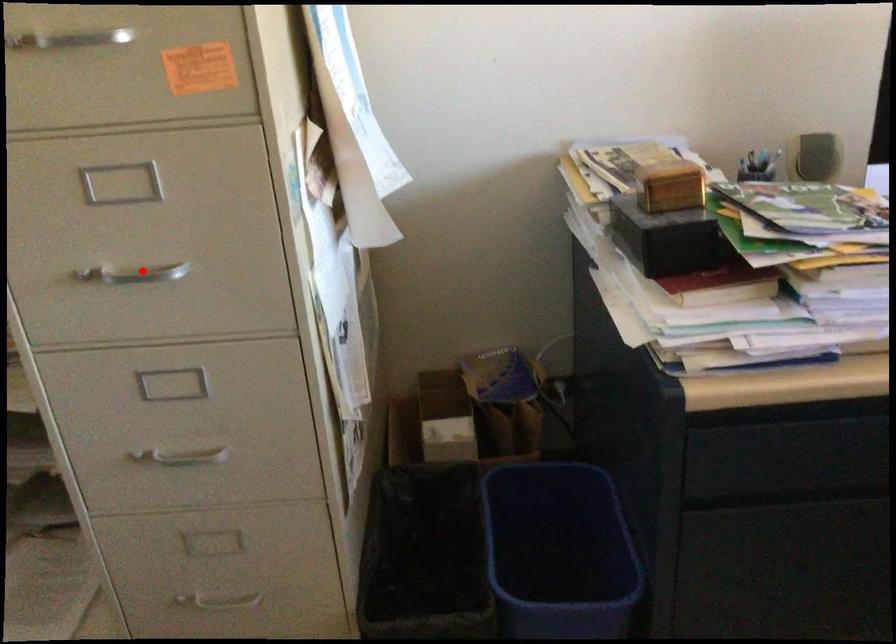
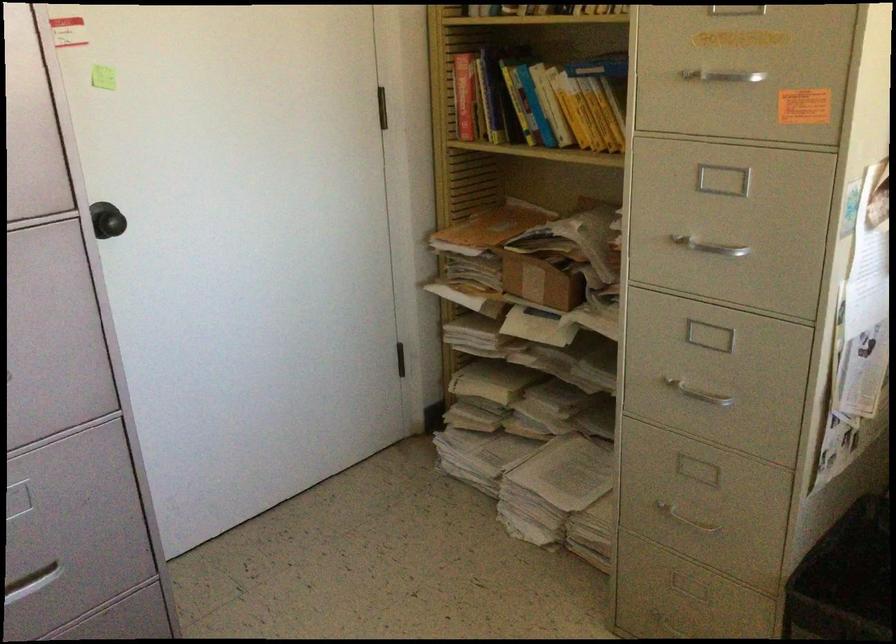
Where in the second image is the point corresponding to the highlighted location from the first image?

(710, 248)